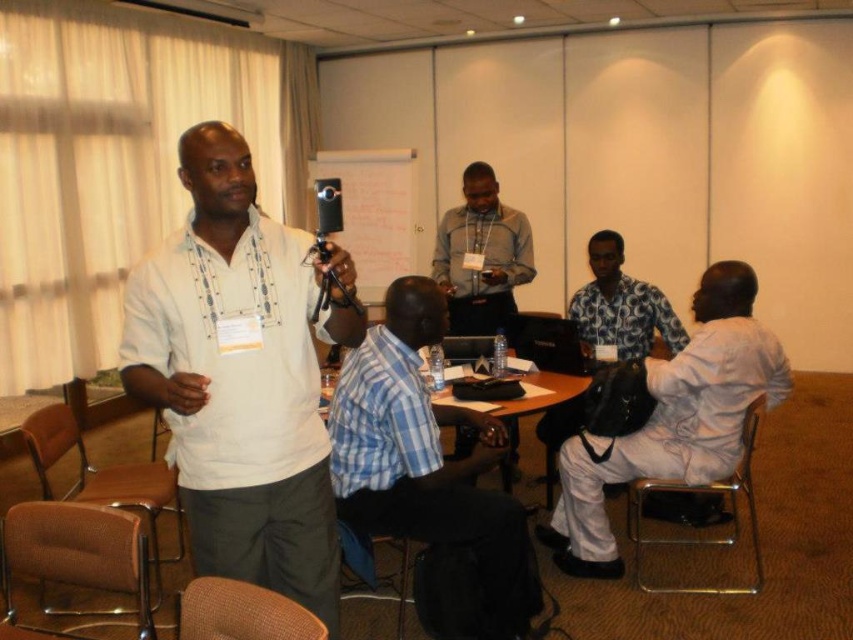
Question: Which of the following is the closest to the observer?

Choices:
 (A) (697, 289)
 (B) (555, 435)
 (C) (473, 256)
 (D) (206, 202)

Answer: (D)

Question: Is gray sweater at center positioned behind floral fabric shirt at center?

Choices:
 (A) yes
 (B) no

Answer: (A)

Question: Can you confirm if blue checkered shirt at center is bigger than white cotton shirt at center?

Choices:
 (A) yes
 (B) no

Answer: (B)

Question: Among these objects, which one is farthest from the camera?

Choices:
 (A) blue checkered shirt at center
 (B) white matte shirt at center
 (C) white cotton shirt at center

Answer: (C)

Question: Which is nearer to the floral fabric shirt at center?

Choices:
 (A) gray sweater at center
 (B) white cotton shirt at center

Answer: (B)

Question: Is gray sweater at center smaller than floral fabric shirt at center?

Choices:
 (A) no
 (B) yes

Answer: (B)